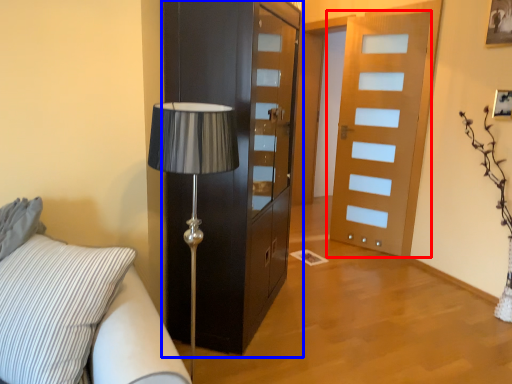
Question: Which object appears farthest to the camera in this image, door (highlighted by a red box) or cabinetry (highlighted by a blue box)?

Choices:
 (A) door
 (B) cabinetry

Answer: (A)